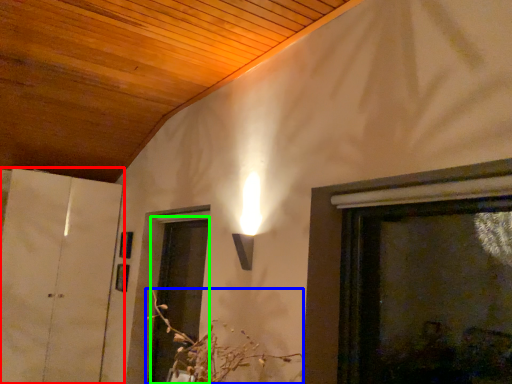
Question: Which object is positioned closest to door (highlighted by a red box)? Select from flower (highlighted by a blue box) and screen door (highlighted by a green box).

Choices:
 (A) flower
 (B) screen door

Answer: (B)